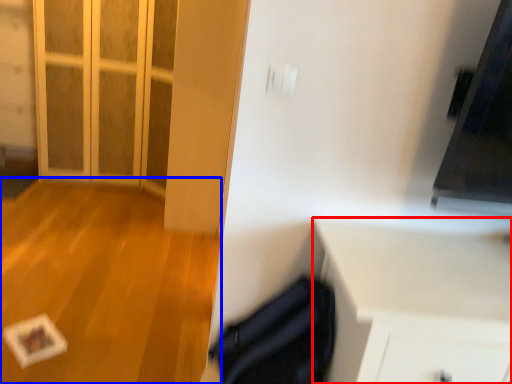
Question: Which point is closer to the camera, cabinetry (highlighted by a red box) or plain (highlighted by a blue box)?

Choices:
 (A) cabinetry
 (B) plain

Answer: (A)